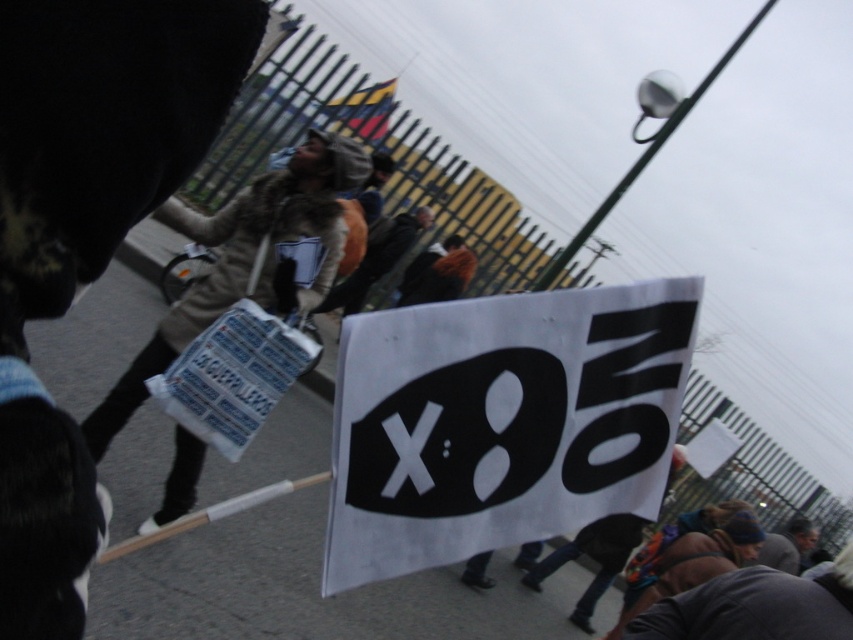
Question: Among these objects, which one is farthest from the camera?

Choices:
 (A) beige fur coat at center
 (B) dark gray fabric cap at lower right
 (C) white paper sign at center
 (D) brown fur coat at center

Answer: (D)

Question: Does brown fur coat at center appear on the left side of dark gray fabric cap at lower right?

Choices:
 (A) yes
 (B) no

Answer: (A)

Question: Which object is closer to the camera taking this photo?

Choices:
 (A) brown fur coat at center
 (B) dark gray fabric cap at lower right

Answer: (B)

Question: Which object is positioned closest to the beige fur coat at center?

Choices:
 (A) brown fur coat at center
 (B) white paper sign at center

Answer: (B)

Question: Can you confirm if beige fur coat at center is thinner than dark gray fabric cap at lower right?

Choices:
 (A) yes
 (B) no

Answer: (A)

Question: Can you confirm if beige fur coat at center is wider than brown fur coat at center?

Choices:
 (A) no
 (B) yes

Answer: (B)